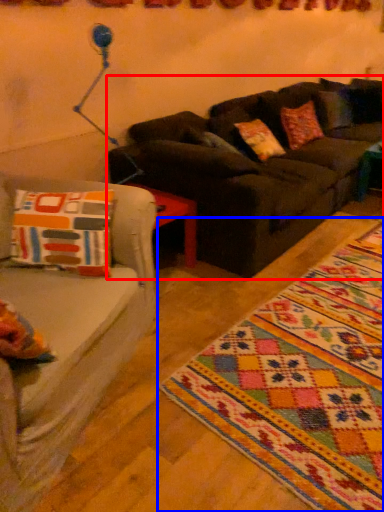
Question: Among these objects, which one is nearest to the camera, studio couch (highlighted by a red box) or mat (highlighted by a blue box)?

Choices:
 (A) studio couch
 (B) mat

Answer: (B)